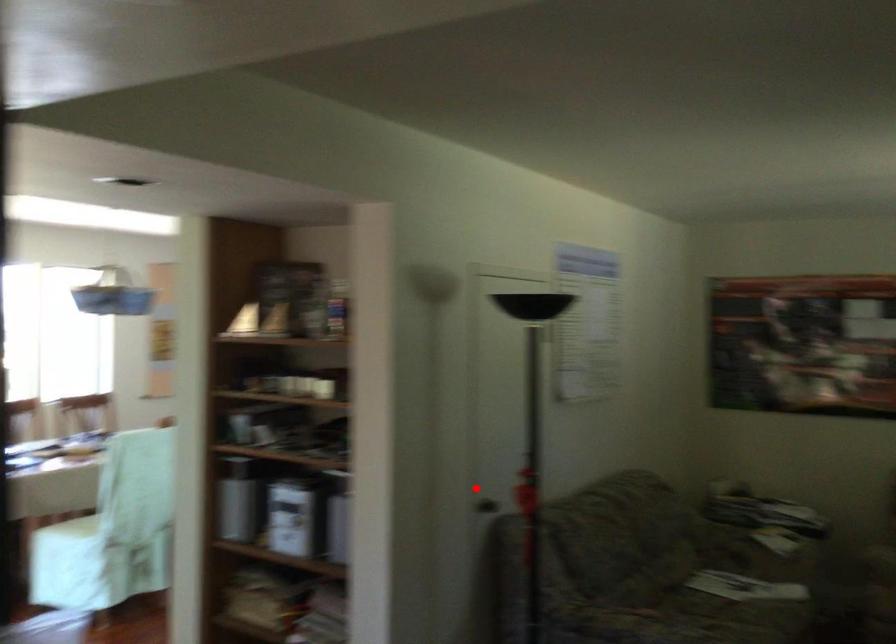
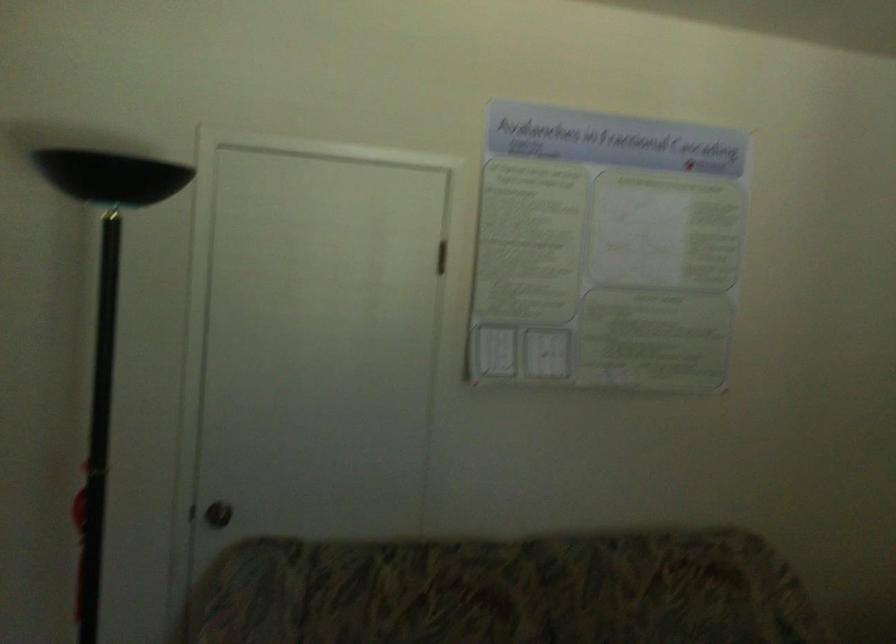
Question: I am providing you with two images of the same scene from different viewpoints. A red point is shown in image1. For the corresponding object point in image2, is it positioned nearer or farther from the camera?

Choices:
 (A) Nearer
 (B) Farther

Answer: (A)